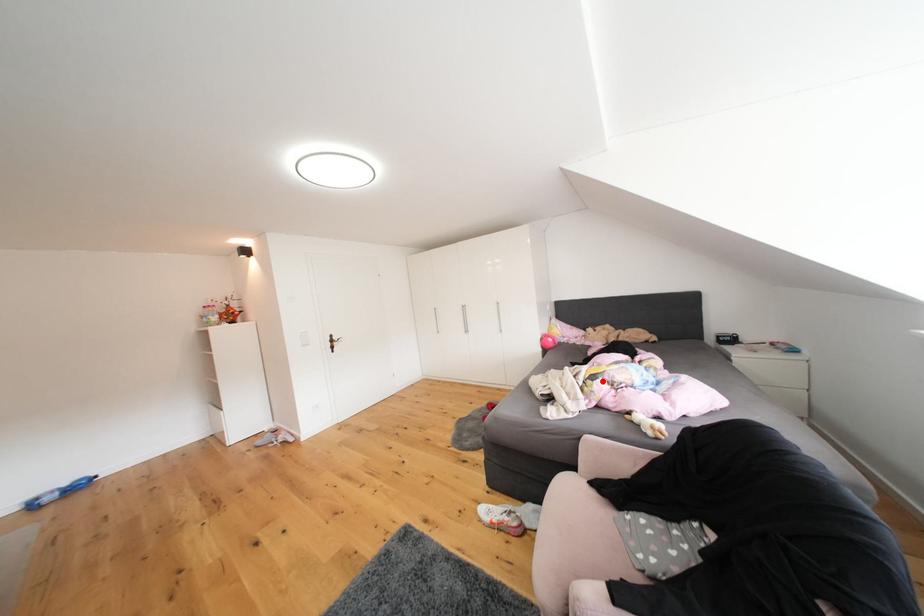
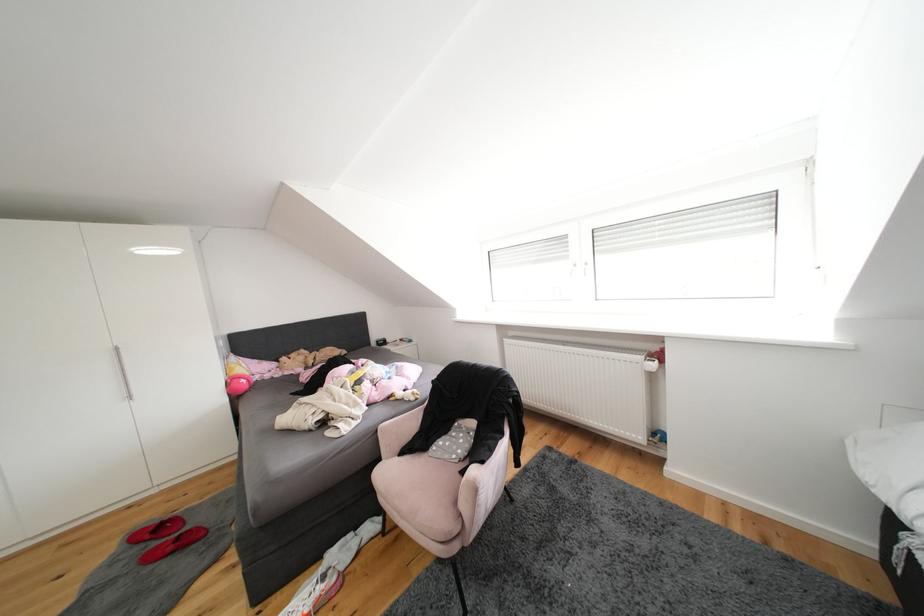
Question: I am providing you with two images of the same scene from different viewpoints. Given a red point in image1, look at the same physical point in image2. Is it:

Choices:
 (A) Closer to the viewpoint
 (B) Farther from the viewpoint

Answer: (B)